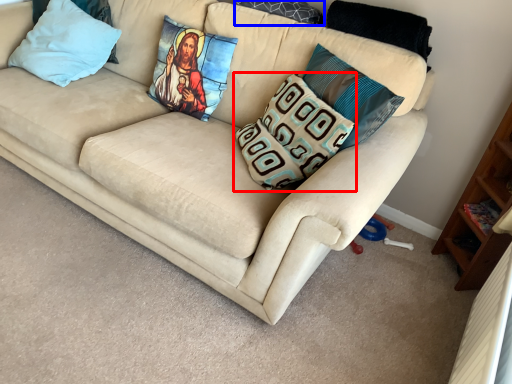
Question: Which object is further to the camera taking this photo, pillow (highlighted by a red box) or pillow (highlighted by a blue box)?

Choices:
 (A) pillow
 (B) pillow

Answer: (B)